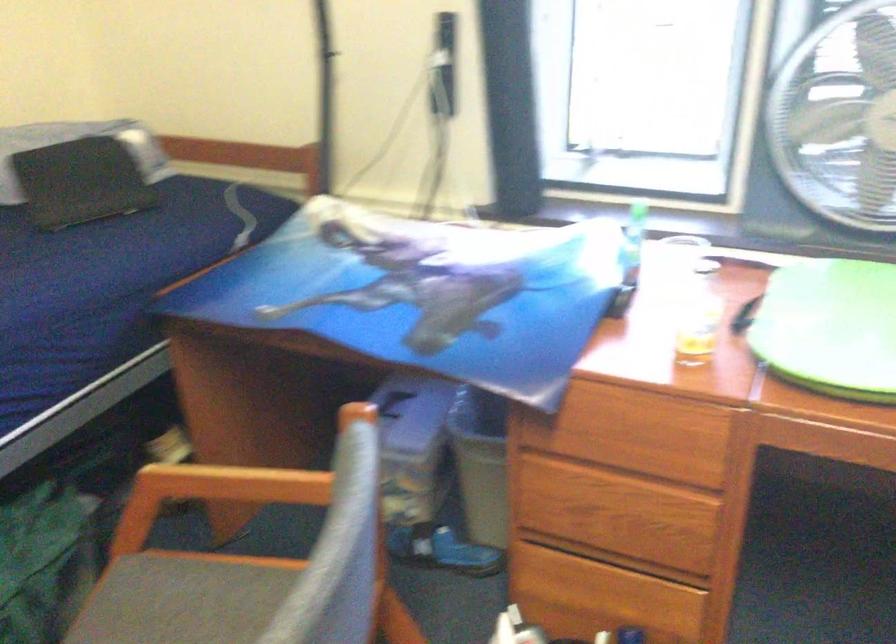
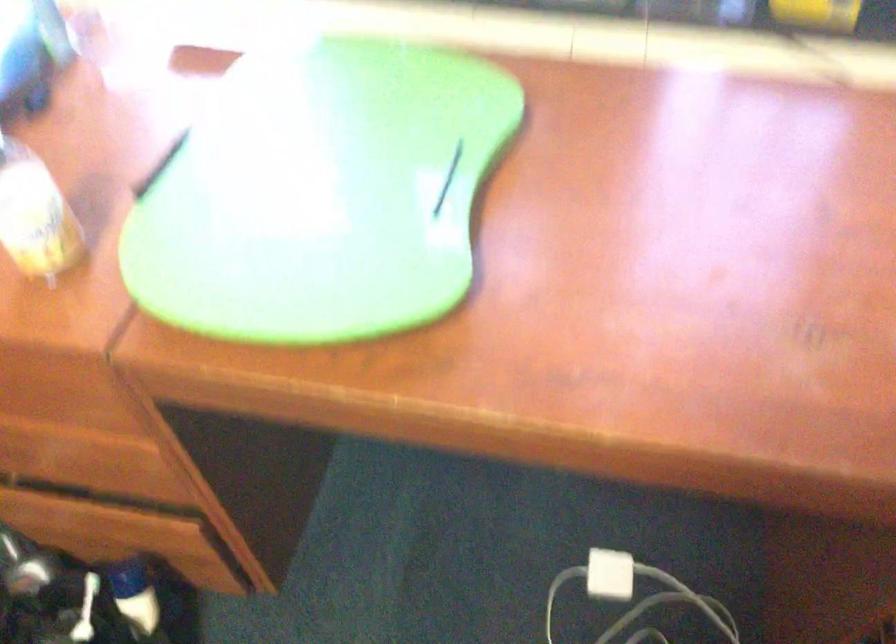
Question: Based on the continuous images, in which direction is the camera rotating? Reply with the corresponding letter.

Choices:
 (A) Left
 (B) Right
 (C) Up
 (D) Down

Answer: (D)